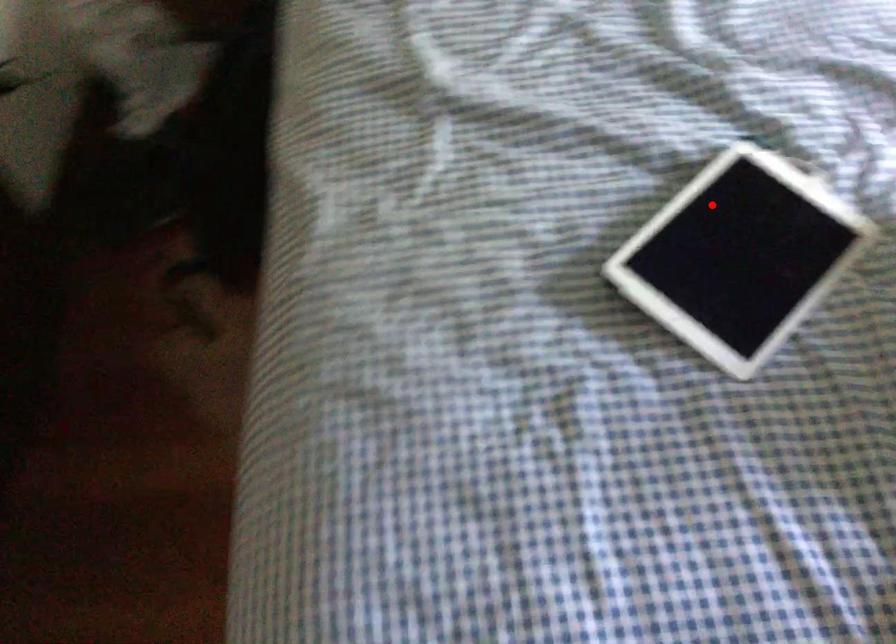
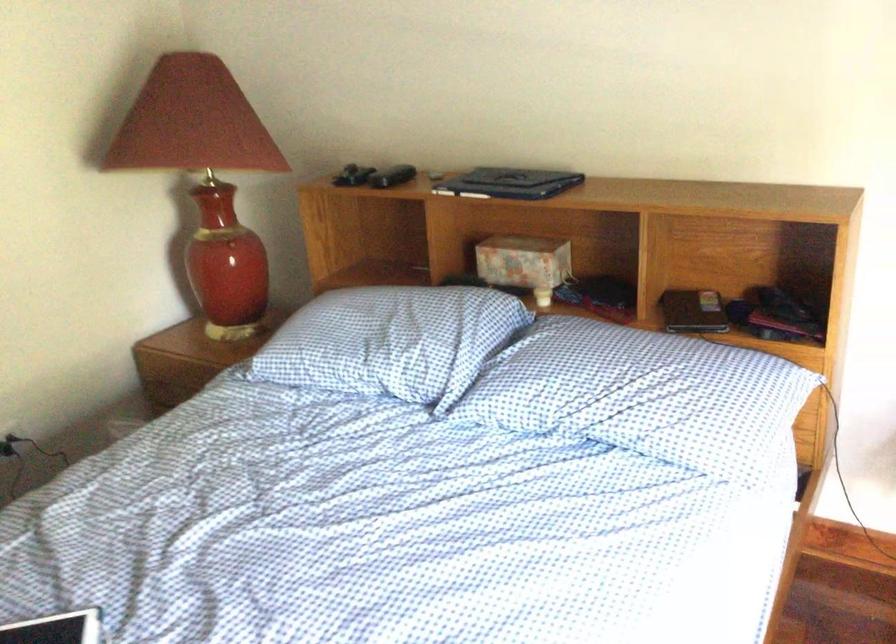
Question: A red point is marked in image1. In image2, is the corresponding 3D point closer to the camera or farther? Reply with the corresponding letter.

Choices:
 (A) The corresponding 3D point is closer.
 (B) The corresponding 3D point is farther.

Answer: (B)